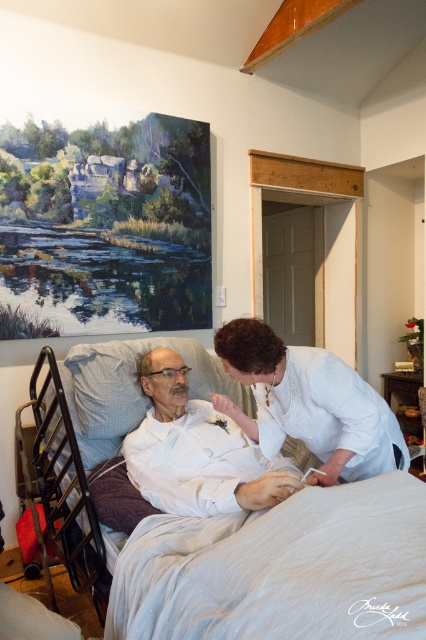
You are a photographer trying to capture a candid moment between the man in the hospital bed and the woman standing beside him. You notice two points of light in the scene, one at point (287, 621) and another at point (216, 436). Which point should you focus on to ensure the subject is in sharp focus if you want the closer point to be clear?

You should focus on point (287, 621) because it is closer to the camera than point (216, 436), ensuring it will be in sharp focus.

Looking at this image, you are a photographer positioned in the room and want to capture a clear photo of both the white satin blouse at center and the white matte shirt at center. Which one will appear larger in the photo?

The white satin blouse at center will appear larger in the photo because it is closer to the photographer than the white matte shirt at center.